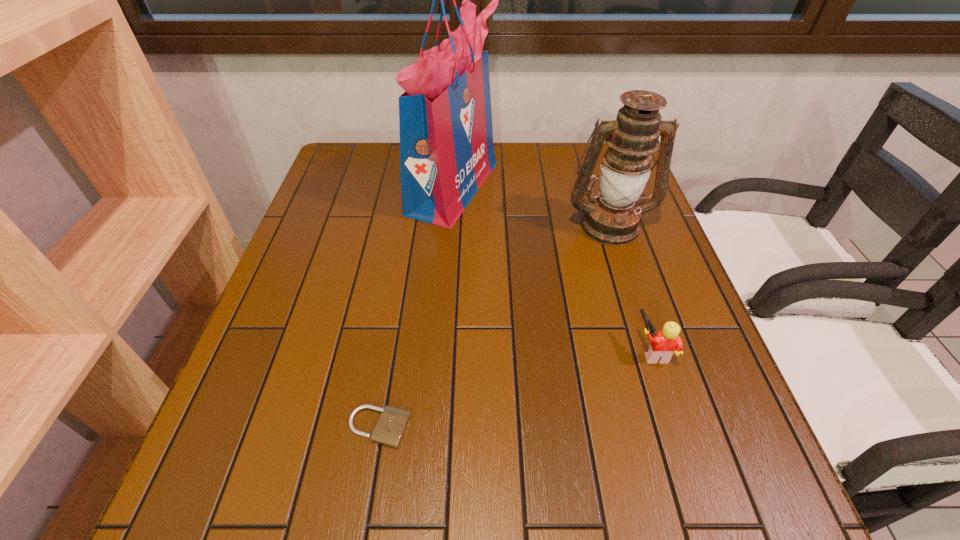
At what (x,y) coordinates should I click in order to perform the action: click on grocery bag. Please return your answer as a coordinate pair (x, y). This screenshot has height=540, width=960. Looking at the image, I should click on (445, 119).

At what (x,y) coordinates should I click in order to perform the action: click on lantern. Please return your answer as a coordinate pair (x, y). Image resolution: width=960 pixels, height=540 pixels. Looking at the image, I should click on (612, 219).

In order to click on the second shortest object in this screenshot , I will do `click(663, 344)`.

Identify the location of Lego. click(x=663, y=344).

Identify the location of the nearest object. (391, 426).

Where is `padlock`? The height and width of the screenshot is (540, 960). padlock is located at coordinates (391, 426).

Locate an element on the screen. The image size is (960, 540). vacant space located on the front-facing side of the grocery bag is located at coordinates (555, 187).

Find the location of a particular element. Image resolution: width=960 pixels, height=540 pixels. vacant space located 0.050m on the front of the lantern is located at coordinates (621, 260).

Where is `vacant point located 0.060m in front of the second shortest object with the accessory visible`? vacant point located 0.060m in front of the second shortest object with the accessory visible is located at coordinates (605, 350).

This screenshot has width=960, height=540. I want to click on free space located in front of the second shortest object with the accessory visible, so click(x=585, y=350).